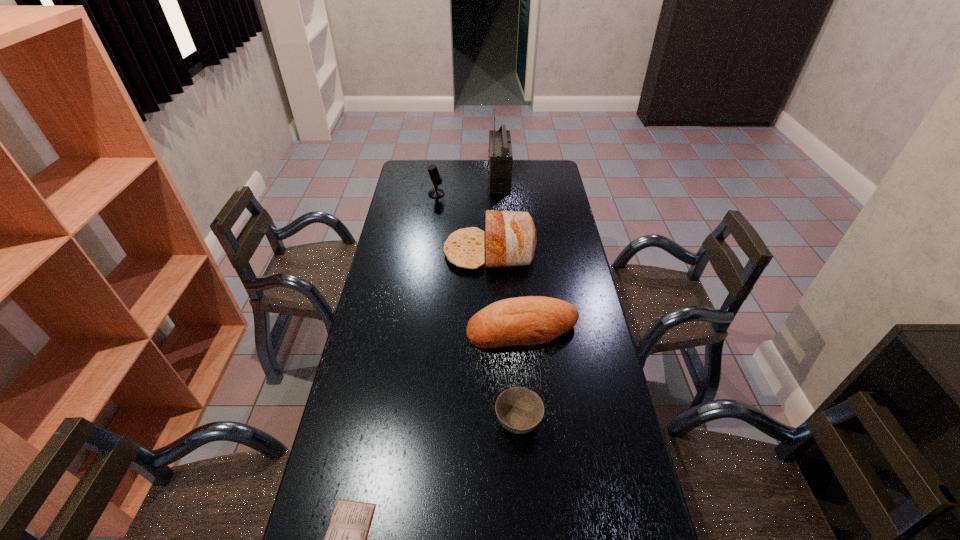
In the image, there is a desktop. Where is `free space at the right edge`? The width and height of the screenshot is (960, 540). free space at the right edge is located at coordinates (578, 248).

In order to click on free space at the far right corner of the desktop in this screenshot , I will do `click(539, 171)`.

Find the location of a particular element. This screenshot has width=960, height=540. empty location between the shorter bread and the fifth farthest object is located at coordinates (520, 375).

Find the location of `blank region between the farther bread and the nearer bread`. blank region between the farther bread and the nearer bread is located at coordinates (506, 290).

The width and height of the screenshot is (960, 540). Find the location of `free space between the fifth tallest object and the third shortest object`. free space between the fifth tallest object and the third shortest object is located at coordinates (520, 375).

Identify the location of object that is the second closest to the fifth farthest object. (345, 539).

Locate which object is the third closest to the tallest object. Please provide its 2D coordinates. Your answer should be formatted as a tuple, i.e. [(x, y)], where the tuple contains the x and y coordinates of a point satisfying the conditions above.

[(532, 320)]

The height and width of the screenshot is (540, 960). I want to click on free point that satisfies the following two spatial constraints: 1. on the back side of the third nearest object; 2. on the front panel of the radio receiver, so click(x=509, y=179).

Locate an element on the screen. free space that satisfies the following two spatial constraints: 1. on the front panel of the radio receiver; 2. on the right side of the fifth tallest object is located at coordinates (514, 422).

At what (x,y) coordinates should I click in order to perform the action: click on vacant space that satisfies the following two spatial constraints: 1. on the front panel of the tallest object; 2. on the left side of the fifth farthest object. Please return your answer as a coordinate pair (x, y). This screenshot has width=960, height=540. Looking at the image, I should click on (514, 422).